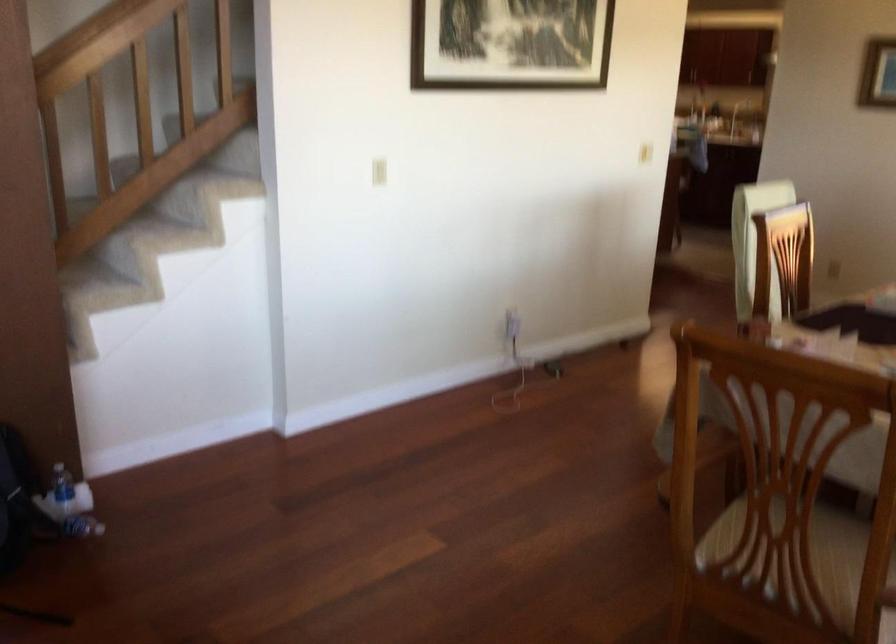
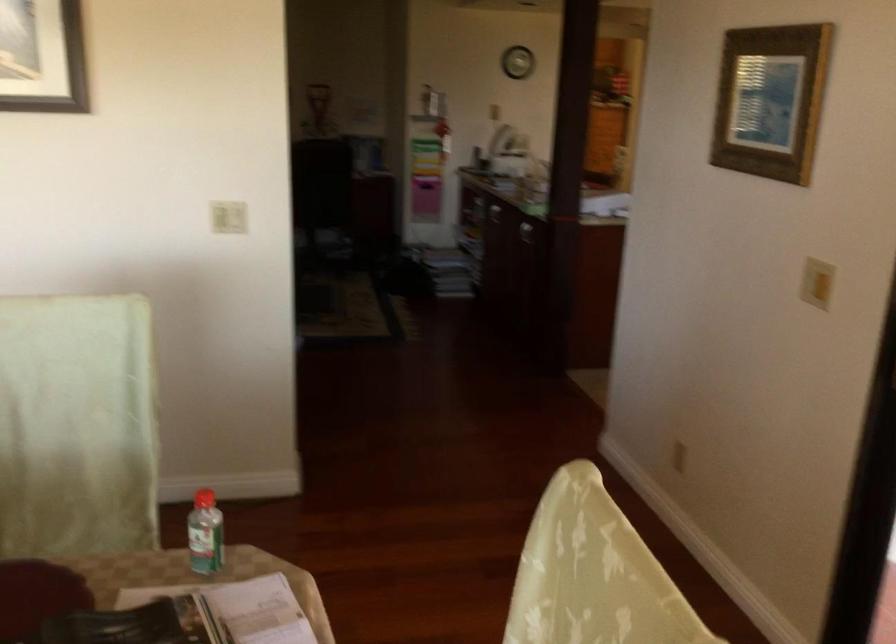
In a continuous first-person perspective shot, in which direction is the camera moving?

The movement direction of the cameraman is right, forward.